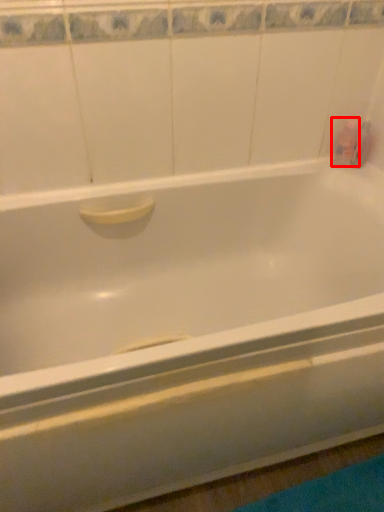
Question: Observing the image, what is the correct spatial positioning of toiletry (annotated by the red box) in reference to toiletry?

Choices:
 (A) right
 (B) left

Answer: (B)